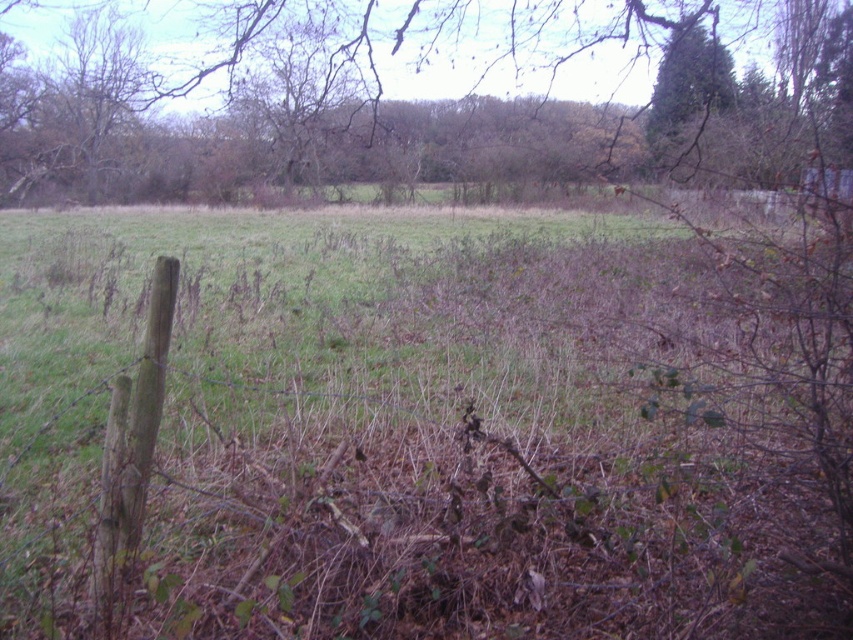
You are a hiker who wants to take a photo of both the brown leafy tree at upper center and the green textured tree at upper right. Since you have a camera with a limited zoom range, you need to stand at a position where both trees are visible in the frame. Considering their heights and positions, where should you position yourself relative to the trees?

You should position yourself closer to the green textured tree at upper right because the brown leafy tree at upper center is taller. This way, both trees will be visible in the frame without one blocking the other.

You are an environmental scientist assessing the health of trees in this rural area. You observe the brown leafy tree at upper center and the green textured tree at upper right. Which tree might have a larger canopy spread based on their appearance?

The brown leafy tree at upper center might be wider than the green textured tree at upper right, indicating it could have a larger canopy spread.

You are a landscape architect planning to plant a new tree in between the brown leafy tree at upper center and the green textured tree at upper right. The new tree requires a minimum of 30 feet of space between it and any existing trees. Based on the current spacing between the two trees, is this feasible?

The brown leafy tree at upper center and green textured tree at upper right are 29.42 feet apart. Since the required minimum space is 30 feet, planting a new tree between them would not be feasible as the existing distance is less than the required spacing.